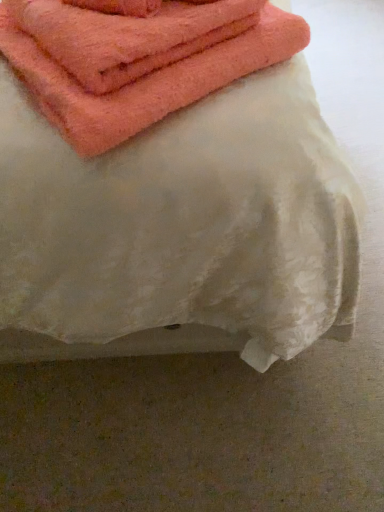
Question: From their relative heights in the image, would you say coral soft towel at upper left is taller or shorter than white textured fabric at upper center?

Choices:
 (A) tall
 (B) short

Answer: (B)

Question: Does point (36, 60) appear closer or farther from the camera than point (62, 356)?

Choices:
 (A) farther
 (B) closer

Answer: (B)

Question: In the image, is coral soft towel at upper left on the left side or the right side of white textured fabric at upper center?

Choices:
 (A) right
 (B) left

Answer: (A)

Question: Do you think white textured fabric at upper center is within coral soft towel at upper left, or outside of it?

Choices:
 (A) inside
 (B) outside

Answer: (B)

Question: From a real-world perspective, is white textured fabric at upper center above or below coral soft towel at upper left?

Choices:
 (A) above
 (B) below

Answer: (B)

Question: From the image's perspective, relative to coral soft towel at upper left, is white textured fabric at upper center above or below?

Choices:
 (A) above
 (B) below

Answer: (A)

Question: Is white textured fabric at upper center wider or thinner than coral soft towel at upper left?

Choices:
 (A) thin
 (B) wide

Answer: (B)